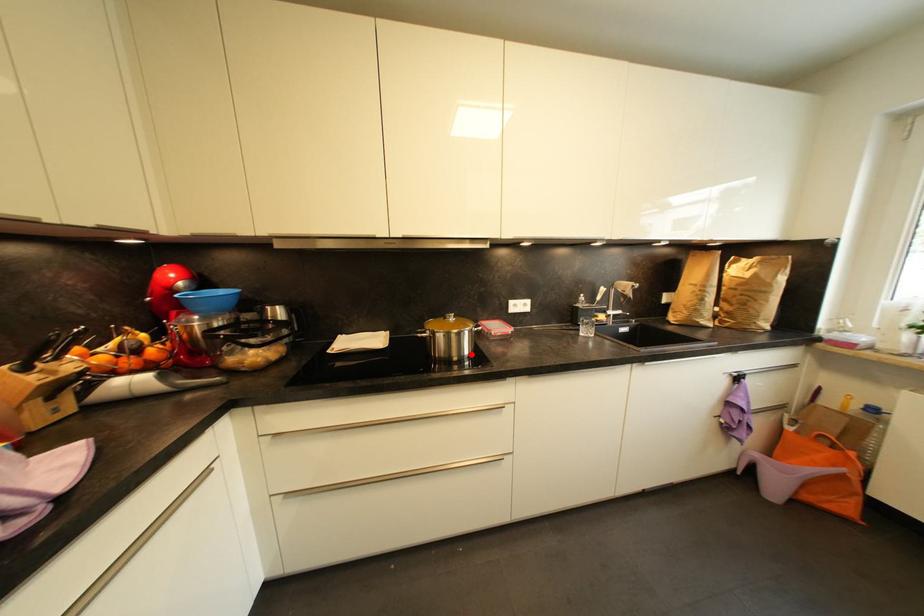
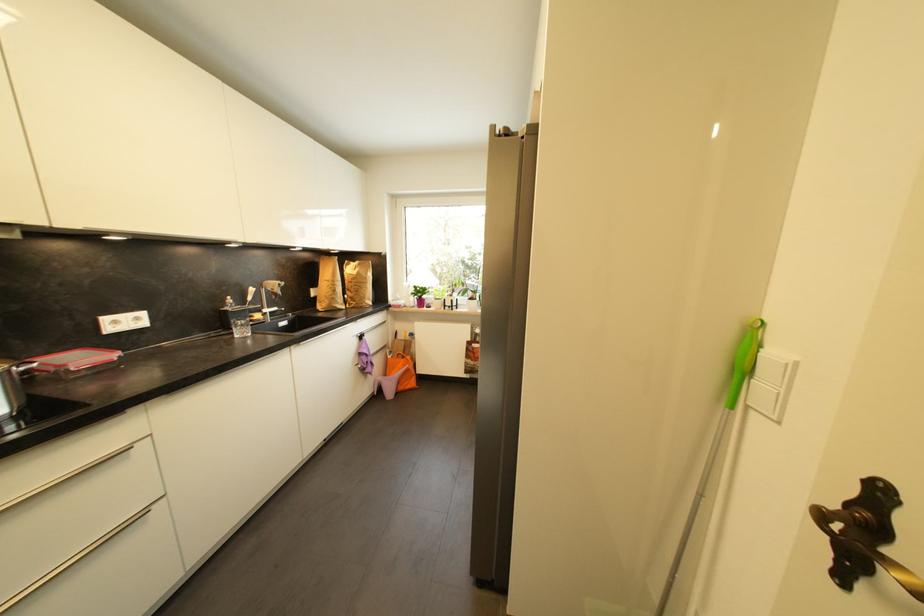
The point at the highlighted location is marked in the first image. Where is the corresponding point in the second image?

(8, 411)